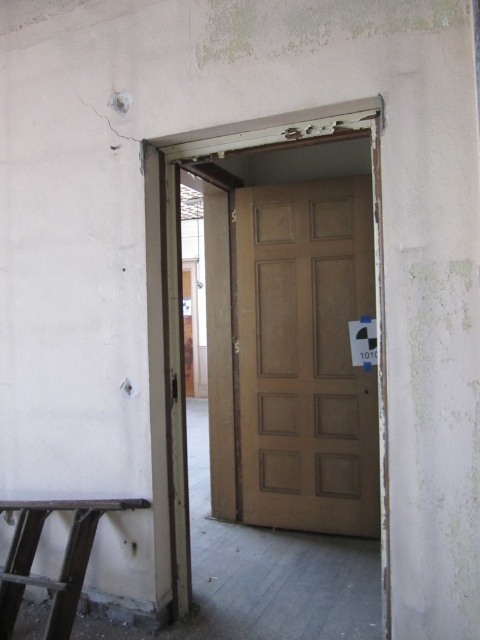
You are a painter who needs to decide which object requires more paint between the matte brown door at center and the metallic stool at lower left. Which one should you prioritize?

The matte brown door at center is larger in size than the metallic stool at lower left, so you should prioritize painting the matte brown door at center first because it has a greater surface area requiring more paint.

You are standing in the room and want to move the metallic stool at lower left to the other side of the matte brown door at center. Can you do this without moving the door?

The metallic stool at lower left is behind the matte brown door at center, so you cannot move it to the other side without moving the door first.

You are standing in the room and want to place a small object on the floor near the metallic stool at lower left. Can you place it directly under the matte brown door at center?

Yes, the matte brown door at center is above the metallic stool at lower left, so placing the object directly under the door would position it near the metallic stool at lower left.